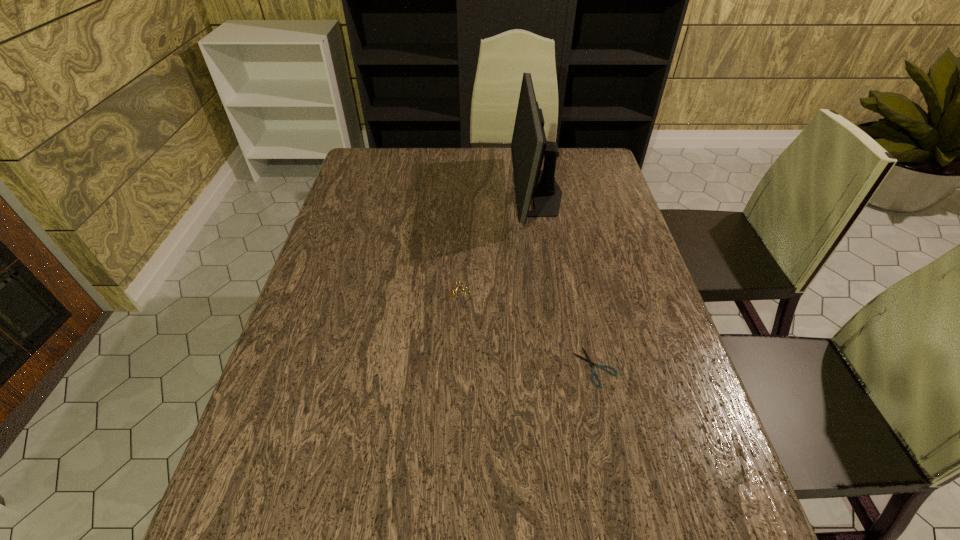
The image size is (960, 540). What are the coordinates of `free space located 0.290m on the left of the shorter shears` in the screenshot? It's located at (441, 367).

Where is `object at the far edge`? The height and width of the screenshot is (540, 960). object at the far edge is located at coordinates (529, 146).

The image size is (960, 540). Find the location of `object present at the right edge`. object present at the right edge is located at coordinates (588, 360).

The width and height of the screenshot is (960, 540). What are the coordinates of `vacant space at the far edge of the desktop` in the screenshot? It's located at (477, 184).

The width and height of the screenshot is (960, 540). What are the coordinates of `free space at the left edge of the desktop` in the screenshot? It's located at (367, 208).

This screenshot has width=960, height=540. In the image, there is a desktop. What are the coordinates of `vacant space at the right edge` in the screenshot? It's located at (633, 365).

Image resolution: width=960 pixels, height=540 pixels. In the image, there is a desktop. What are the coordinates of `vacant space at the far right corner` in the screenshot? It's located at (583, 168).

Identify the location of empty location between the farther shears and the shortest object. (525, 330).

The height and width of the screenshot is (540, 960). I want to click on vacant space in between the shorter shears and the second shortest object, so click(x=525, y=330).

The height and width of the screenshot is (540, 960). What are the coordinates of `free space between the farthest object and the shorter shears` in the screenshot? It's located at (566, 280).